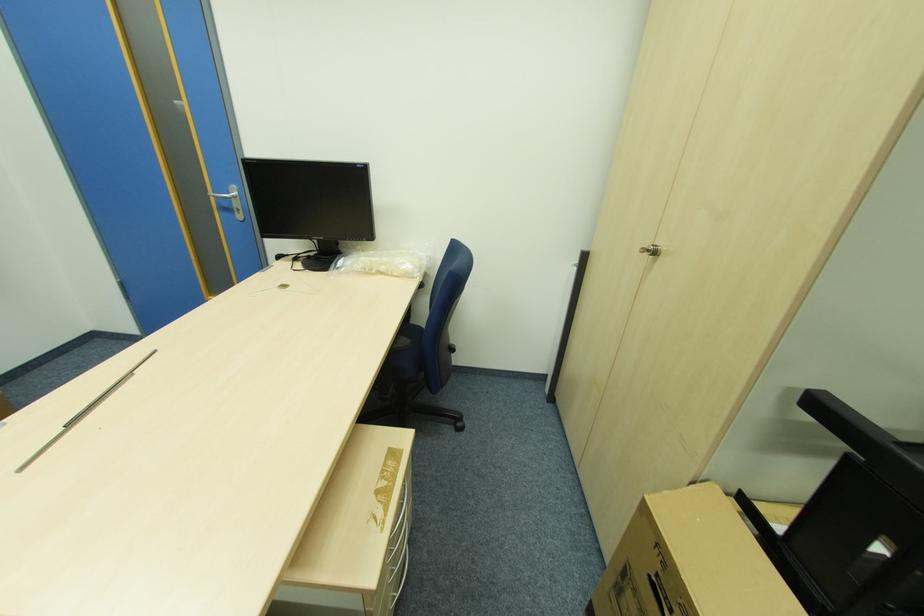
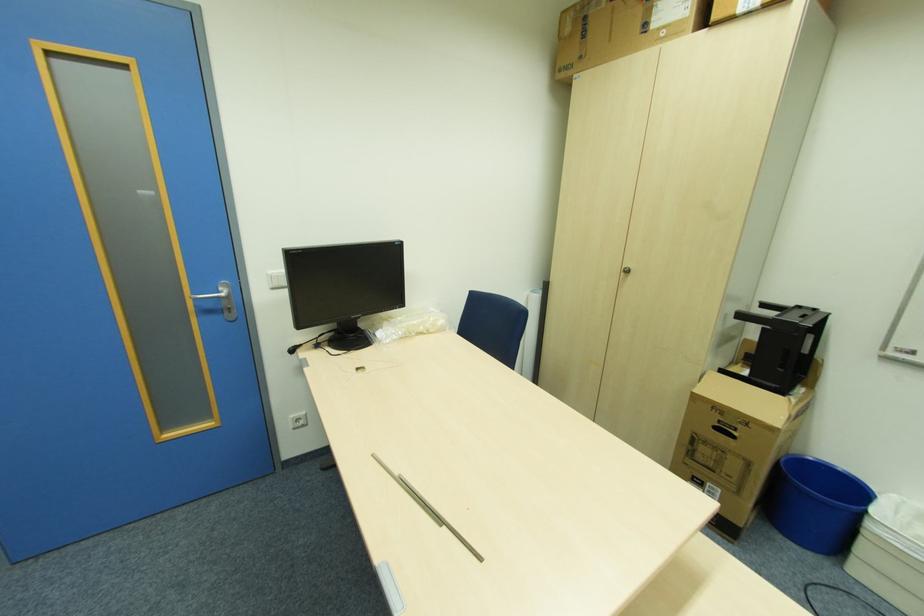
In the second image, find the point that corresponds to (x=241, y=213) in the first image.

(234, 310)